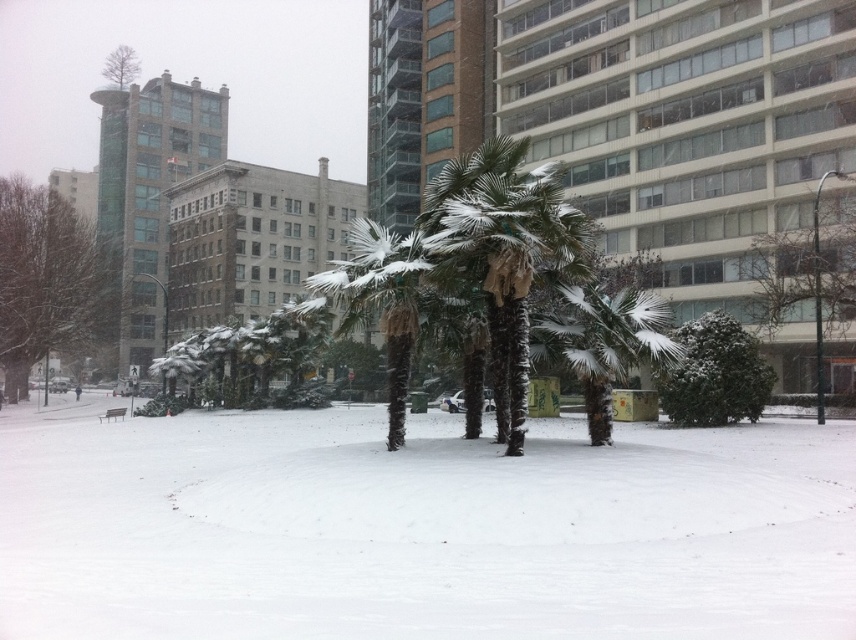
In the scene shown: You are standing in the snowy urban area and want to take a photo of the green leafy tree at left and the green textured bush at center. Which object should you focus on first to ensure it appears sharp in your photo?

You should focus on the green leafy tree at left first because it is closer to you than the green textured bush at center, making it the foreground object.

In the scene shown: You are standing in the snowy urban scene and want to take a photo of both the green leafy tree at left and the green leafy tree at right. Which tree should you position closer to the camera to include both in the frame without any obstruction?

You should position closer to the green leafy tree at left because the green leafy tree at right is behind it, so moving closer to the left tree will allow both to be visible without the right tree being blocked.

You are planning to place a new bench in the snowy urban scene. The bench requires a space wider than the green textured bush at center. Can the area around the green textured palm tree at center accommodate the bench?

The green textured palm tree at center might be wider than the green textured bush at center, so the area around it could potentially accommodate the bench if the palm tree is indeed wider. However, the exact width is uncertain based on the provided information.